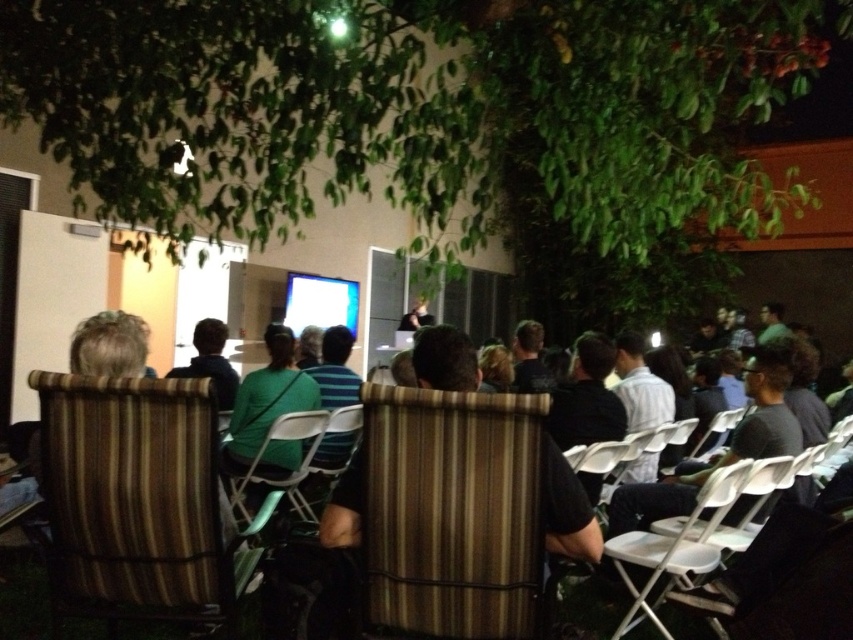
Question: Considering the real-world distances, which object is farthest from the green striped chair at center?

Choices:
 (A) dark green shirt at center
 (B) green fabric chair at center
 (C) striped fabric chair at center

Answer: (A)

Question: Which point appears farthest from the camera in this image?

Choices:
 (A) (122, 444)
 (B) (22, 576)
 (C) (196, 342)
 (D) (258, 460)

Answer: (C)

Question: Can you confirm if white plastic chair at lower right is wider than striped fabric chair at center?

Choices:
 (A) no
 (B) yes

Answer: (B)

Question: Which point is farther from the camera taking this photo?

Choices:
 (A) (303, 468)
 (B) (322, 410)
 (C) (735, 474)
 (D) (608, 628)

Answer: (A)

Question: Can you confirm if dark green shirt at center is positioned below striped fabric chair at center?

Choices:
 (A) no
 (B) yes

Answer: (A)

Question: Where is green striped chair at center located in relation to green fabric chair at center in the image?

Choices:
 (A) right
 (B) left

Answer: (B)